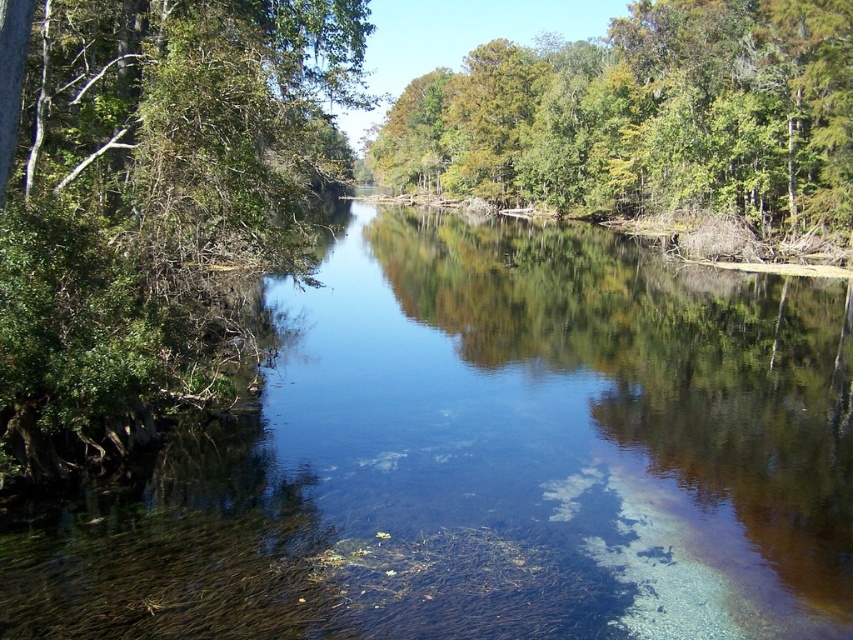
Can you confirm if clear water at center is positioned above green leafy trees at upper center?

No.

How much distance is there between clear water at center and green leafy trees at upper center?

clear water at center is 162.67 feet from green leafy trees at upper center.

Is point (277, 445) closer to camera compared to point (798, 108)?

Yes, it is.

This screenshot has height=640, width=853. Identify the location of clear water at center. (490, 458).

Does clear water at center have a lesser height compared to green leafy tree at left?

Yes, clear water at center is shorter than green leafy tree at left.

How much distance is there between clear water at center and green leafy tree at left?

8.79 meters

This screenshot has height=640, width=853. Identify the location of clear water at center. (490, 458).

Locate an element on the screen. This screenshot has width=853, height=640. clear water at center is located at coordinates (490, 458).

Does green leafy tree at left appear over green leafy trees at upper center?

No, green leafy tree at left is not above green leafy trees at upper center.

Which of these two, green leafy tree at left or green leafy trees at upper center, stands taller?

green leafy trees at upper center is taller.

Find the location of a particular element. This screenshot has height=640, width=853. green leafy tree at left is located at coordinates (148, 195).